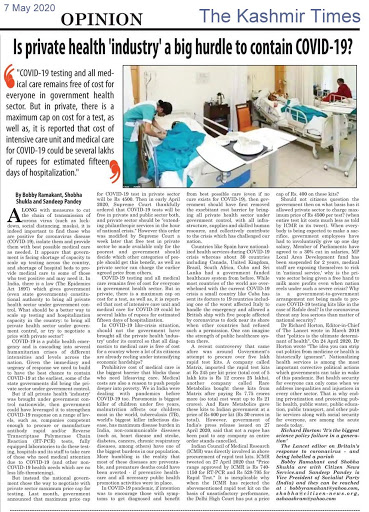
This screenshot has width=369, height=512. Identify the location of iv stand. (145, 95).